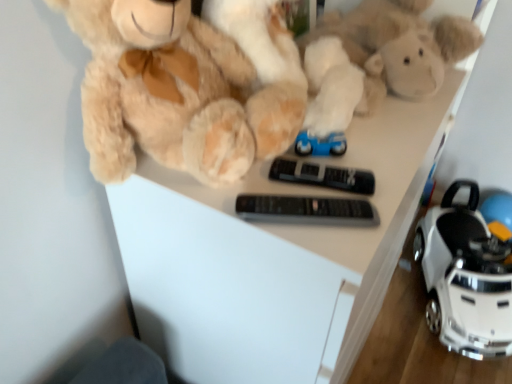
What do you see at coordinates (465, 277) in the screenshot?
I see `white plastic toy car at lower right` at bounding box center [465, 277].

You are a GUI agent. You are given a task and a screenshot of the screen. Output one action in this format:
    pyautogui.click(x=<x>, y=<y>)
    Task: Click on the fluffy beige teddy bear at upper left
    The image size is (512, 384).
    Given the screenshot: What is the action you would take?
    pyautogui.click(x=161, y=90)

Looking at their sizes, would you say black plastic remote at center, acting as the second control starting from the front, is wider or thinner than black plastic remote at center, placed as the second control when sorted from back to front?

In the image, black plastic remote at center, acting as the second control starting from the front, appears to be more narrow than black plastic remote at center, placed as the second control when sorted from back to front.

The image size is (512, 384). What are the coordinates of `control lying in front of the black plastic remote at center, the first control in the back-to-front sequence` in the screenshot? It's located at (306, 210).

Choose the correct answer: Is black plastic remote at center, acting as the second control starting from the front, inside black plastic remote at center, placed as the second control when sorted from back to front, or outside it?

black plastic remote at center, acting as the second control starting from the front, is not enclosed by black plastic remote at center, placed as the second control when sorted from back to front.

Does black plastic remote at center, the first control in the back-to-front sequence, appear on the left side of black plastic remote at center, placed as the second control when sorted from back to front?

No, black plastic remote at center, the first control in the back-to-front sequence, is not to the left of black plastic remote at center, placed as the second control when sorted from back to front.

Looking at this image, from the image's perspective, which is below, black plastic remote at center, which is the 1th control from front to back, or soft plush toy at center?

From the image's view, black plastic remote at center, which is the 1th control from front to back, is below.

Considering the sizes of objects black plastic remote at center, which is the 1th control from front to back, and soft plush toy at center in the image provided, who is bigger, black plastic remote at center, which is the 1th control from front to back, or soft plush toy at center?

soft plush toy at center is bigger.

Where is `toy on the right of black plastic remote at center, which is the 1th control from front to back`? This screenshot has height=384, width=512. toy on the right of black plastic remote at center, which is the 1th control from front to back is located at coordinates (385, 56).

From a real-world perspective, which object rests below the other?

From a 3D spatial view, black plastic remote at center, placed as the second control when sorted from back to front, is below.

From the image's perspective, is fluffy beige teddy bear at upper left located above or below soft plush toy at center?

Clearly, from the image's perspective, fluffy beige teddy bear at upper left is below soft plush toy at center.

Between fluffy beige teddy bear at upper left and soft plush toy at center, which one has more height?

fluffy beige teddy bear at upper left.

Does fluffy beige teddy bear at upper left have a larger size compared to soft plush toy at center?

Incorrect, fluffy beige teddy bear at upper left is not larger than soft plush toy at center.

From the image's perspective, is white plastic toy car at lower right on black plastic remote at center, which is the 1th control from front to back?

Incorrect, from the image's perspective, white plastic toy car at lower right is lower than black plastic remote at center, which is the 1th control from front to back.

From a real-world perspective, is white plastic toy car at lower right on black plastic remote at center, placed as the second control when sorted from back to front?

No.

Does white plastic toy car at lower right turn towards black plastic remote at center, which is the 1th control from front to back?

No, white plastic toy car at lower right is not facing towards black plastic remote at center, which is the 1th control from front to back.

In the scene shown: Does white plastic toy car at lower right touch black plastic remote at center, placed as the second control when sorted from back to front?

No.

Is black plastic remote at center, the first control in the back-to-front sequence, inside or outside of white plastic toy car at lower right?

The correct answer is: outside.

Identify the location of land vehicle lying below the black plastic remote at center, acting as the second control starting from the front (from the image's perspective). The width and height of the screenshot is (512, 384). pos(465,277).

Does black plastic remote at center, acting as the second control starting from the front, have a larger size compared to white plastic toy car at lower right?

No, black plastic remote at center, acting as the second control starting from the front, is not bigger than white plastic toy car at lower right.

Which is in front, point (332, 178) or point (429, 285)?

Point (332, 178)

Is black plastic remote at center, acting as the second control starting from the front, to the left of soft plush toy at center from the viewer's perspective?

Yes, black plastic remote at center, acting as the second control starting from the front, is to the left of soft plush toy at center.

Is soft plush toy at center surrounded by black plastic remote at center, acting as the second control starting from the front?

No, soft plush toy at center is not surrounded by black plastic remote at center, acting as the second control starting from the front.

Between black plastic remote at center, the first control in the back-to-front sequence, and soft plush toy at center, which one has smaller width?

black plastic remote at center, the first control in the back-to-front sequence, is thinner.

Is point (344, 187) farther from viewer compared to point (423, 53)?

No, it is not.

From the image's perspective, between white plastic toy car at lower right and black plastic remote at center, the first control in the back-to-front sequence, which one is located above?

From the image's view, black plastic remote at center, the first control in the back-to-front sequence, is above.

Is white plastic toy car at lower right inside the boundaries of black plastic remote at center, acting as the second control starting from the front, or outside?

The correct answer is: outside.

Is white plastic toy car at lower right taller than black plastic remote at center, the first control in the back-to-front sequence?

Yes, white plastic toy car at lower right is taller than black plastic remote at center, the first control in the back-to-front sequence.

Considering the relative sizes of white plastic toy car at lower right and black plastic remote at center, acting as the second control starting from the front, in the image provided, is white plastic toy car at lower right smaller than black plastic remote at center, acting as the second control starting from the front,?

Actually, white plastic toy car at lower right might be larger than black plastic remote at center, acting as the second control starting from the front.

Locate an element on the screen. This screenshot has height=384, width=512. control below the black plastic remote at center, acting as the second control starting from the front (from the image's perspective) is located at coordinates (306, 210).

Locate an element on the screen. The height and width of the screenshot is (384, 512). toy lying above the black plastic remote at center, placed as the second control when sorted from back to front (from the image's perspective) is located at coordinates (385, 56).

Considering their positions, is black plastic remote at center, the first control in the back-to-front sequence, positioned closer to black plastic remote at center, placed as the second control when sorted from back to front, than white plastic toy car at lower right?

Among the two, black plastic remote at center, the first control in the back-to-front sequence, is located nearer to black plastic remote at center, placed as the second control when sorted from back to front.

Which object lies further to the anchor point black plastic remote at center, placed as the second control when sorted from back to front, black plastic remote at center, the first control in the back-to-front sequence, or fluffy beige teddy bear at upper left?

The object further to black plastic remote at center, placed as the second control when sorted from back to front, is fluffy beige teddy bear at upper left.

Based on their spatial positions, is fluffy beige teddy bear at upper left or black plastic remote at center, placed as the second control when sorted from back to front, closer to soft plush toy at center?

fluffy beige teddy bear at upper left.

Which object lies nearer to the anchor point white plastic toy car at lower right, fluffy beige teddy bear at upper left or black plastic remote at center, the first control in the back-to-front sequence?

Among the two, black plastic remote at center, the first control in the back-to-front sequence, is located nearer to white plastic toy car at lower right.

Looking at the image, which one is located closer to fluffy beige teddy bear at upper left, black plastic remote at center, which is the 1th control from front to back, or soft plush toy at center?

black plastic remote at center, which is the 1th control from front to back.

Which object lies nearer to the anchor point black plastic remote at center, placed as the second control when sorted from back to front, white plastic toy car at lower right or black plastic remote at center, the first control in the back-to-front sequence?

The object closer to black plastic remote at center, placed as the second control when sorted from back to front, is black plastic remote at center, the first control in the back-to-front sequence.

Looking at the image, which one is located closer to black plastic remote at center, acting as the second control starting from the front, black plastic remote at center, which is the 1th control from front to back, or white plastic toy car at lower right?

black plastic remote at center, which is the 1th control from front to back, lies closer to black plastic remote at center, acting as the second control starting from the front, than the other object.

Estimate the real-world distances between objects in this image. Which object is closer to black plastic remote at center, placed as the second control when sorted from back to front, soft plush toy at center or black plastic remote at center, the first control in the back-to-front sequence?

black plastic remote at center, the first control in the back-to-front sequence, is positioned closer to the anchor black plastic remote at center, placed as the second control when sorted from back to front.

In order to click on toy between black plastic remote at center, placed as the second control when sorted from back to front, and white plastic toy car at lower right in this screenshot , I will do `click(385, 56)`.

At what (x,y) coordinates should I click in order to perform the action: click on toy located between fluffy beige teddy bear at upper left and white plastic toy car at lower right in the left-right direction. Please return your answer as a coordinate pair (x, y). Looking at the image, I should click on (385, 56).

Identify the location of control between soft plush toy at center and black plastic remote at center, placed as the second control when sorted from back to front, from top to bottom. The height and width of the screenshot is (384, 512). click(323, 176).

In order to click on control positioned between fluffy beige teddy bear at upper left and black plastic remote at center, acting as the second control starting from the front, from near to far in this screenshot , I will do `click(306, 210)`.